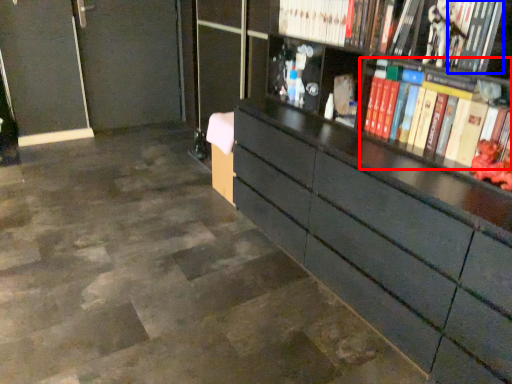
Question: Among these objects, which one is nearest to the camera, book (highlighted by a red box) or book (highlighted by a blue box)?

Choices:
 (A) book
 (B) book

Answer: (A)